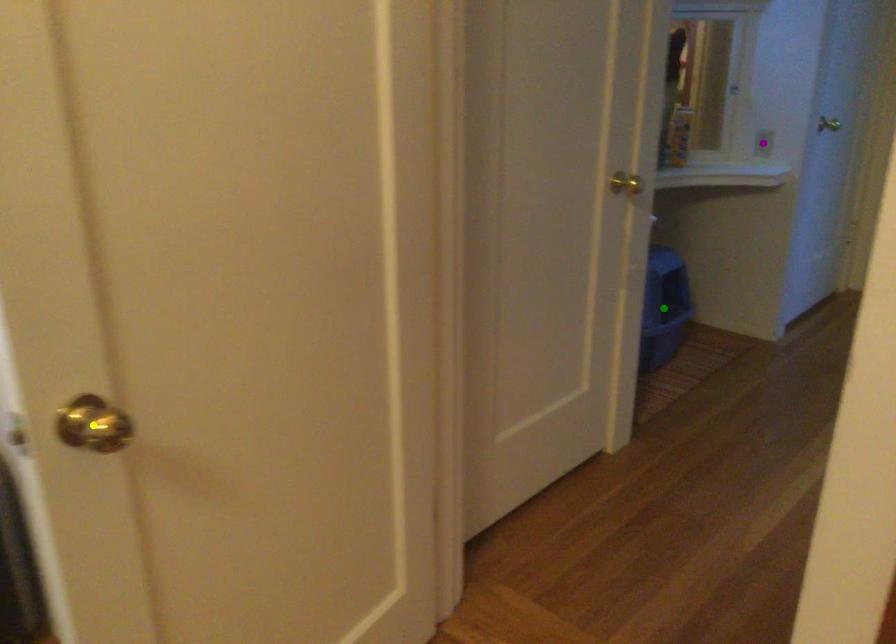
From the picture: Order these from farthest to nearest:
purple point | yellow point | green point

purple point
green point
yellow point